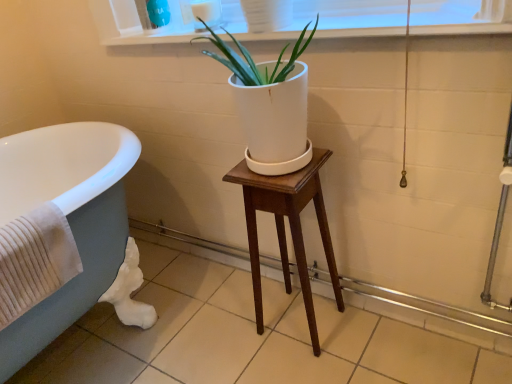
Where is `vacant space positioned to the left of mahogany wood stool at center`? The width and height of the screenshot is (512, 384). vacant space positioned to the left of mahogany wood stool at center is located at coordinates (234, 338).